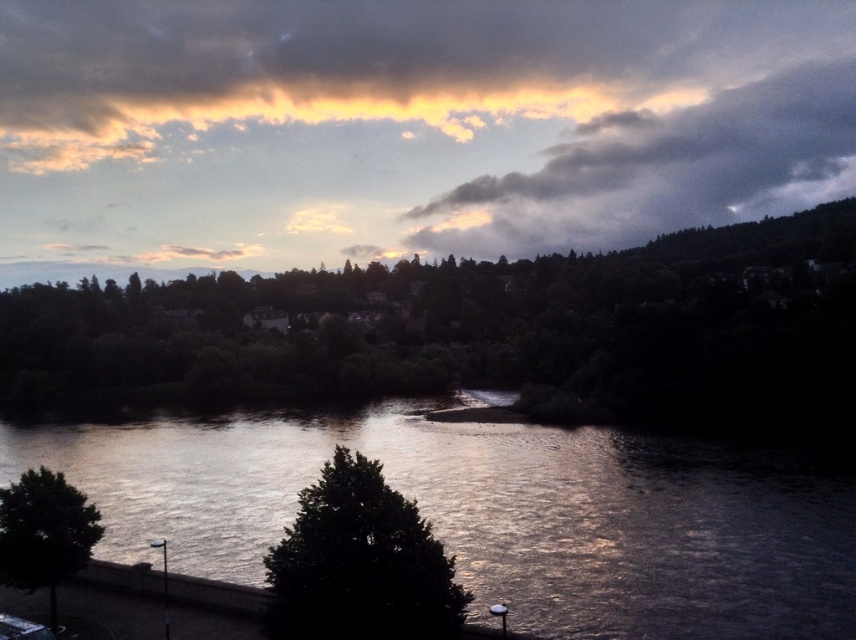
Question: Observing the image, what is the correct spatial positioning of cloudy sky at upper center in reference to green leafy tree at lower left?

Choices:
 (A) left
 (B) right

Answer: (B)

Question: Which object is closer to the camera taking this photo?

Choices:
 (A) silvery reflective water at center
 (B) cloudy sky at upper center
 (C) dark green leafy tree at center
 (D) green leafy tree at center

Answer: (C)

Question: Among these objects, which one is farthest from the camera?

Choices:
 (A) cloudy sky at upper center
 (B) dark green leafy tree at center

Answer: (A)

Question: Is cloudy sky at upper center to the right of dark green leafy tree at center from the viewer's perspective?

Choices:
 (A) no
 (B) yes

Answer: (B)

Question: Among these objects, which one is farthest from the camera?

Choices:
 (A) cloudy sky at upper center
 (B) green leafy tree at center
 (C) silvery reflective water at center

Answer: (A)

Question: Can you confirm if green leafy tree at center is positioned above green leafy tree at lower left?

Choices:
 (A) yes
 (B) no

Answer: (A)